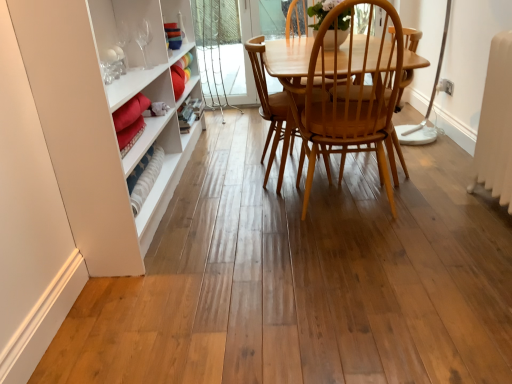
Find the location of `vacant space in between light brown wood chair at center and light brown wood chair at center`. vacant space in between light brown wood chair at center and light brown wood chair at center is located at coordinates (331, 181).